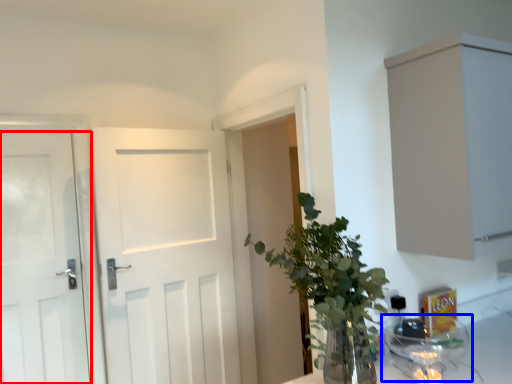
Question: Which of the following is the closest to the observer, door (highlighted by a red box) or glass jar (highlighted by a blue box)?

Choices:
 (A) door
 (B) glass jar

Answer: (B)